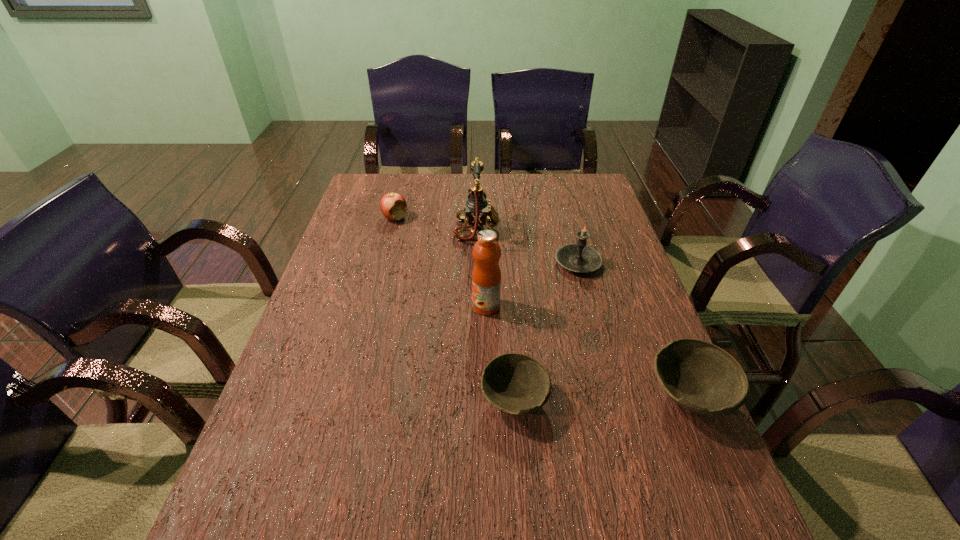
Find the location of a particular element. Image resolution: width=960 pixels, height=540 pixels. vacant space located 0.270m on the left of the taller bowl is located at coordinates (525, 396).

Image resolution: width=960 pixels, height=540 pixels. I want to click on vacant region located on the left of the apple, so pos(368,218).

Find the location of a particular element. This screenshot has width=960, height=540. free point located 0.160m on the left of the candle is located at coordinates (501, 262).

The width and height of the screenshot is (960, 540). In order to click on free space located 0.240m on the front of the telephone, featuring the rotary dial in this screenshot , I will do `click(573, 231)`.

The image size is (960, 540). I want to click on vacant region located 0.260m on the front label of the fruit juice, so click(x=374, y=306).

At what (x,y) coordinates should I click in order to perform the action: click on vacant position located on the front label of the fruit juice. Please return your answer as a coordinate pair (x, y). This screenshot has height=540, width=960. Looking at the image, I should click on (453, 306).

This screenshot has height=540, width=960. Find the location of `free space located on the front label of the fruit juice`. free space located on the front label of the fruit juice is located at coordinates tap(439, 306).

Locate an element on the screen. This screenshot has width=960, height=540. object that is at the left edge is located at coordinates (393, 205).

The width and height of the screenshot is (960, 540). I want to click on bowl at the right edge, so click(x=700, y=377).

Where is `candle that is at the right edge`? candle that is at the right edge is located at coordinates (579, 257).